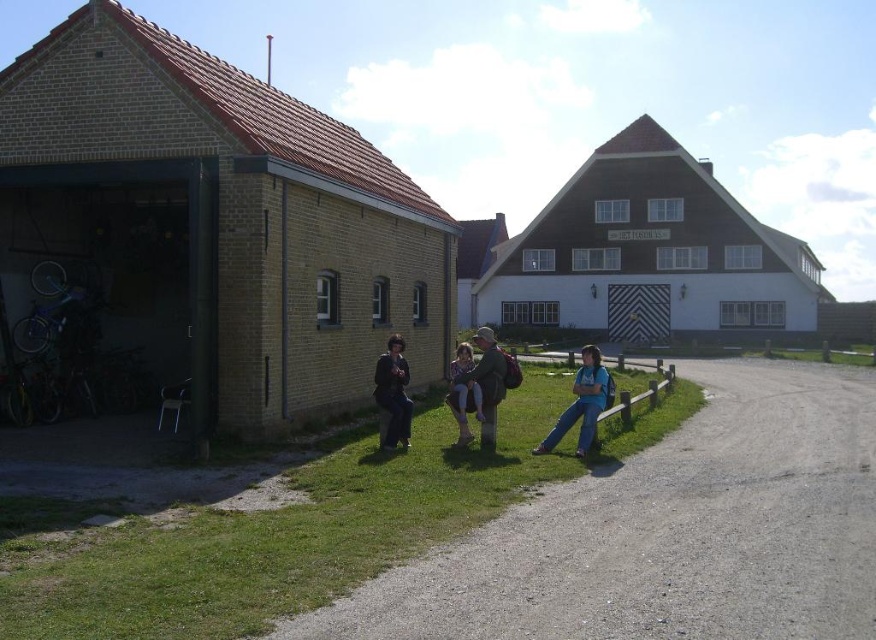
Question: Which of the following is the farthest from the observer?

Choices:
 (A) (479, 432)
 (B) (562, 428)

Answer: (A)

Question: Which of these objects is positioned farthest from the blue jeans at lower right?

Choices:
 (A) denim jacket at center
 (B) dark brown leather jacket at center

Answer: (B)

Question: Where is blue jeans at lower right located in relation to denim jacket at center in the image?

Choices:
 (A) left
 (B) right

Answer: (B)

Question: Among these objects, which one is nearest to the camera?

Choices:
 (A) blue jeans at lower right
 (B) denim jacket at center
 (C) matte gray jacket at center
 (D) dark brown leather jacket at center

Answer: (A)

Question: Is blue jeans at lower right closer to camera compared to denim jacket at center?

Choices:
 (A) no
 (B) yes

Answer: (B)

Question: Can you confirm if blue jeans at lower right is thinner than dark brown leather jacket at center?

Choices:
 (A) yes
 (B) no

Answer: (B)